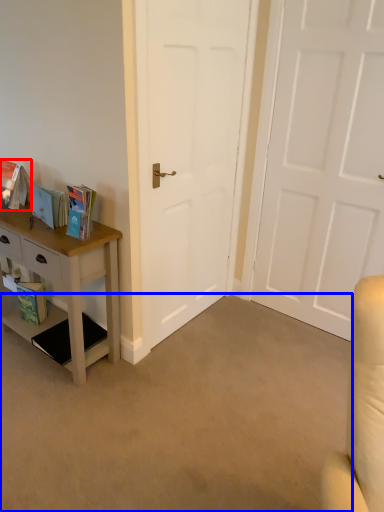
Question: Which object appears farthest to the camera in this image, book (highlighted by a red box) or plain (highlighted by a blue box)?

Choices:
 (A) book
 (B) plain

Answer: (A)